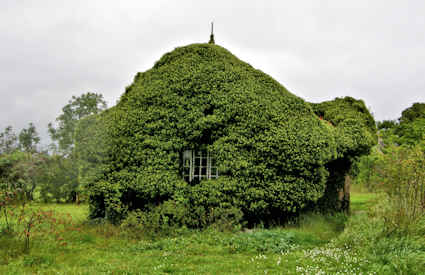
Locate an element on the screen. This screenshot has height=275, width=425. red flowers is located at coordinates (64, 239), (57, 230), (68, 225), (66, 218), (51, 218), (28, 232), (36, 216), (12, 210).